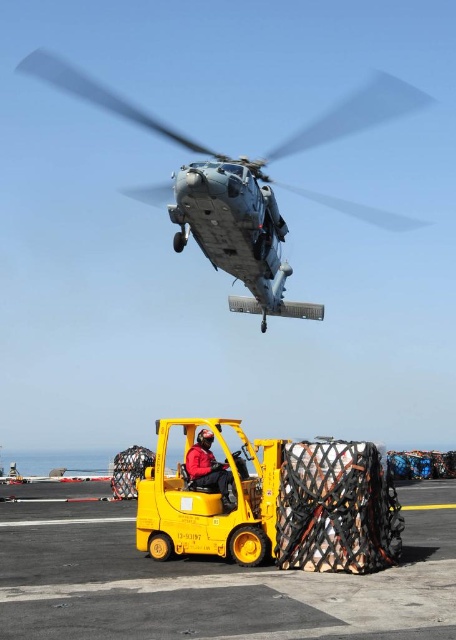
How far apart are metallic gray helicopter at upper center and red fabric jacket at center?

metallic gray helicopter at upper center and red fabric jacket at center are 20.02 feet apart.

Is point (253, 264) behind point (191, 467)?

Yes, point (253, 264) is farther from viewer.

This screenshot has height=640, width=456. In order to click on metallic gray helicopter at upper center in this screenshot , I will do `click(245, 182)`.